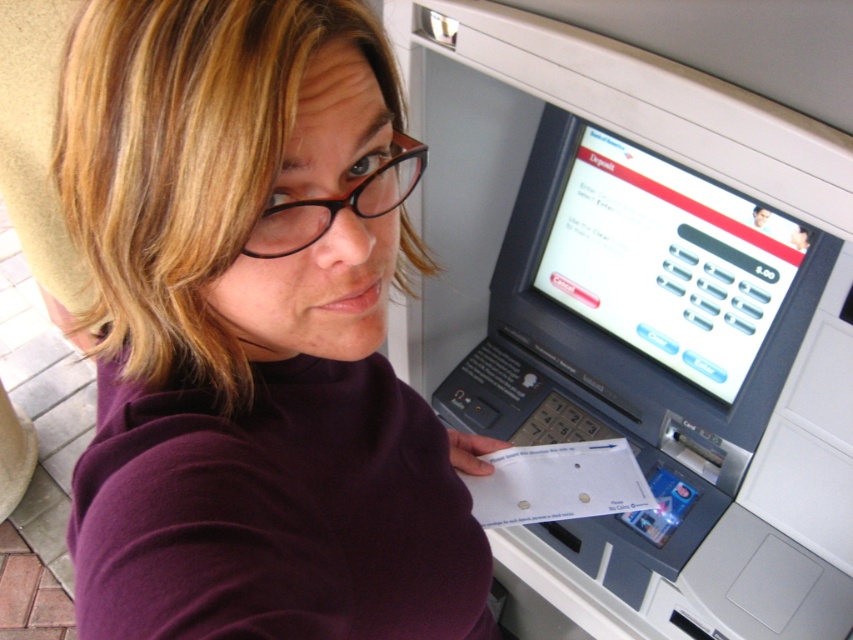
You are a security camera monitoring the ATM. You notice the person wearing the purple turtleneck sweater at center and black plastic glasses at upper center. Which item is positioned higher on their body?

The black plastic glasses at upper center are positioned higher on the person than the purple turtleneck sweater at center.

You are designing a new ATM interface and need to ensure accessibility for users wearing glasses. Considering the placement and size of the black plastic glasses at upper center and the purple turtleneck sweater at center, which object should be prioritized for ergonomic adjustments to accommodate users who might need to lean forward or adjust their posture while using the ATM?

The black plastic glasses at upper center should be prioritized for ergonomic adjustments since they are positioned closer to the ATM screen, indicating the user might need to adjust their posture or distance to read the display clearly. The purple turtleneck sweater at center, being wider, may require more space for comfortable movement but does not directly impact the interaction with the screen.

You are a delivery person who needs to leave a package at the ATM location shown. The package must be placed exactly at the point marked by coordinates point (254,333). However, there is an object at that location. What object is blocking the delivery location?

The purple turtleneck sweater at center is located at point (254,333), so it is blocking the delivery location.